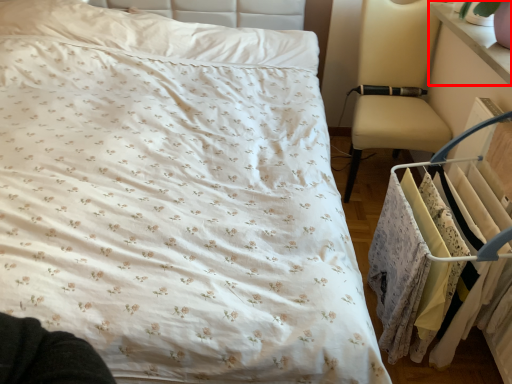
Question: Where is changing table (annotated by the red box) located in relation to closet in the image?

Choices:
 (A) right
 (B) left

Answer: (A)